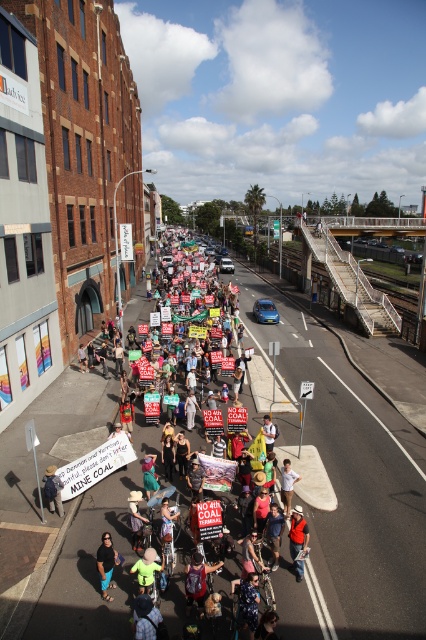
Based on the scene description, can you determine which object is larger in size between the multicolored fabric crowd at center and the white cotton shirt at center?

The multicolored fabric crowd at center is bigger than the white cotton shirt at center according to the description.

You are a photographer trying to capture a clear shot of the white cotton shirt at center during the protest. However, the multicolored fabric crowd at center is blocking your view. Based on the scene description, can you determine if the crowd is between you and the shirt, or behind the shirt?

The multicolored fabric crowd at center is above the white cotton shirt at center, so the crowd is positioned higher up and might not block the view directly. Adjust your angle to look downward or move to a higher vantage point to capture the shirt without obstruction.